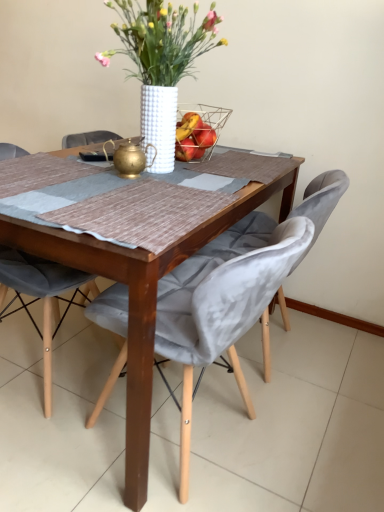
This screenshot has width=384, height=512. Find the location of `velvet grey chair at center, acting as the second chair starting from the right`. velvet grey chair at center, acting as the second chair starting from the right is located at coordinates pyautogui.click(x=41, y=296).

What is the approximate width of white textured vase at center?

It is 47.75 centimeters.

This screenshot has width=384, height=512. What do you see at coordinates (129, 158) in the screenshot?
I see `gold metallic teapot at center` at bounding box center [129, 158].

Describe the element at coordinates (320, 202) in the screenshot. I see `velvet grey swivel chair at right` at that location.

Locate an element on the screen. This screenshot has width=384, height=512. wire mesh basket at center is located at coordinates (199, 131).

Identify the location of velvet grey chair at center, which is the first chair in left-to-right order. (41, 296).

Relative to wire mesh basket at center, is velvet grey swivel chair at right in front or behind?

Clearly, velvet grey swivel chair at right is in front of wire mesh basket at center.

Locate an element on the screen. basket behind the velvet grey swivel chair at right is located at coordinates (199, 131).

From the image's perspective, does velvet grey swivel chair at right appear higher than wire mesh basket at center?

No, from the image's perspective, velvet grey swivel chair at right is not over wire mesh basket at center.

From a real-world perspective, who is located lower, velvet grey swivel chair at right or wire mesh basket at center?

velvet grey swivel chair at right, from a real-world perspective.

Between white textured vase at center and wire mesh basket at center, which one has less height?

wire mesh basket at center.

Is white textured vase at center facing towards wire mesh basket at center?

No, white textured vase at center does not turn towards wire mesh basket at center.

Can we say white textured vase at center lies outside wire mesh basket at center?

Absolutely, white textured vase at center is external to wire mesh basket at center.

Would you say white textured vase at center is a long distance from wire mesh basket at center?

No, white textured vase at center is not far from wire mesh basket at center.

Does wire mesh basket at center touch wooden table at center?

There is a gap between wire mesh basket at center and wooden table at center.

What's the angular difference between wire mesh basket at center and wooden table at center's facing directions?

There is a 0.378-degree angle between the facing directions of wire mesh basket at center and wooden table at center.

From a real-world perspective, is wire mesh basket at center positioned above or below wooden table at center?

wire mesh basket at center is situated higher than wooden table at center in the real world.

From the image's perspective, which is below, wire mesh basket at center or wooden table at center?

From the image's view, wooden table at center is below.

Which of these two, velvet grey chair at center, acting as the 2th chair starting from the left, or wire mesh basket at center, is bigger?

With larger size is velvet grey chair at center, acting as the 2th chair starting from the left.

Considering their positions, is velvet grey chair at center, the 1th chair positioned from the right, located in front of or behind wire mesh basket at center?

In the image, velvet grey chair at center, the 1th chair positioned from the right, appears in front of wire mesh basket at center.

From the image's perspective, is velvet grey chair at center, acting as the 2th chair starting from the left, located above wire mesh basket at center?

Incorrect, from the image's perspective, velvet grey chair at center, acting as the 2th chair starting from the left, is lower than wire mesh basket at center.

Does velvet grey chair at center, the 1th chair positioned from the right, touch wire mesh basket at center?

velvet grey chair at center, the 1th chair positioned from the right, is not next to wire mesh basket at center, and they're not touching.

Does point (5, 265) lie behind point (306, 249)?

Yes.

From a real-world perspective, is velvet grey chair at center, which is the first chair in left-to-right order, on top of velvet grey swivel chair at right?

Yes, from a real-world perspective, velvet grey chair at center, which is the first chair in left-to-right order, is above velvet grey swivel chair at right.

The image size is (384, 512). What are the coordinates of `swivel chair behind the velvet grey chair at center, which is the first chair in left-to-right order` in the screenshot? It's located at (320, 202).

Is velvet grey chair at center, which is the first chair in left-to-right order, situated inside velvet grey swivel chair at right or outside?

velvet grey chair at center, which is the first chair in left-to-right order, exists outside the volume of velvet grey swivel chair at right.

Considering the relative sizes of velvet grey chair at center, which is the first chair in left-to-right order, and white textured vase at center in the image provided, is velvet grey chair at center, which is the first chair in left-to-right order, taller than white textured vase at center?

Yes.

Is the surface of velvet grey chair at center, acting as the second chair starting from the right, in direct contact with white textured vase at center?

They are not placed beside each other.

Which is further, (53, 302) or (210, 21)?

The point (53, 302) is more distant.

From the image's perspective, is velvet grey chair at center, acting as the second chair starting from the right, located above white textured vase at center?

No.

Which is behind, point (290, 173) or point (332, 206)?

Point (290, 173)

Is wooden table at center positioned before velvet grey swivel chair at right?

Yes.

In the scene shown: Does wooden table at center have a lesser height compared to velvet grey swivel chair at right?

Indeed, wooden table at center has a lesser height compared to velvet grey swivel chair at right.

Identify the location of swivel chair on the right of wire mesh basket at center. [320, 202].

Locate an element on the screen. This screenshot has width=384, height=512. basket below the white textured vase at center (from the image's perspective) is located at coordinates (199, 131).

Estimate the real-world distances between objects in this image. Which object is further from gold metallic teapot at center, velvet grey chair at center, which is the first chair in left-to-right order, or white textured vase at center?

velvet grey chair at center, which is the first chair in left-to-right order, is further to gold metallic teapot at center.

From the image, which object appears to be nearer to gold metallic teapot at center, velvet grey chair at center, acting as the second chair starting from the right, or wire mesh basket at center?

wire mesh basket at center.

Considering their positions, is velvet grey chair at center, the 1th chair positioned from the right, positioned further to wire mesh basket at center than white textured vase at center?

Among the two, velvet grey chair at center, the 1th chair positioned from the right, is located further to wire mesh basket at center.

Looking at the image, which one is located further to white textured vase at center, velvet grey swivel chair at right or velvet grey chair at center, acting as the 2th chair starting from the left?

Based on the image, velvet grey swivel chair at right appears to be further to white textured vase at center.

Which object lies further to the anchor point velvet grey chair at center, acting as the 2th chair starting from the left, wooden table at center or white textured vase at center?

white textured vase at center is further to velvet grey chair at center, acting as the 2th chair starting from the left.

Looking at the image, which one is located closer to wooden table at center, velvet grey chair at center, acting as the 2th chair starting from the left, or velvet grey swivel chair at right?

velvet grey chair at center, acting as the 2th chair starting from the left, lies closer to wooden table at center than the other object.

Estimate the real-world distances between objects in this image. Which object is closer to velvet grey chair at center, which is the first chair in left-to-right order, wire mesh basket at center or velvet grey chair at center, the 1th chair positioned from the right?

velvet grey chair at center, the 1th chair positioned from the right.

Estimate the real-world distances between objects in this image. Which object is closer to velvet grey chair at center, acting as the second chair starting from the right, velvet grey swivel chair at right or white textured vase at center?

white textured vase at center.

Where is `tea pot located between velvet grey chair at center, which is the first chair in left-to-right order, and wooden table at center in the left-right direction`? tea pot located between velvet grey chair at center, which is the first chair in left-to-right order, and wooden table at center in the left-right direction is located at coordinates (129, 158).

At what (x,y) coordinates should I click in order to perform the action: click on tea pot between white textured vase at center and wooden table at center from top to bottom. Please return your answer as a coordinate pair (x, y). Looking at the image, I should click on (129, 158).

Image resolution: width=384 pixels, height=512 pixels. In order to click on swivel chair between white textured vase at center and wooden table at center from top to bottom in this screenshot , I will do click(320, 202).

Find the location of a particular element. tea pot between white textured vase at center and velvet grey chair at center, the 1th chair positioned from the right, from top to bottom is located at coordinates (129, 158).